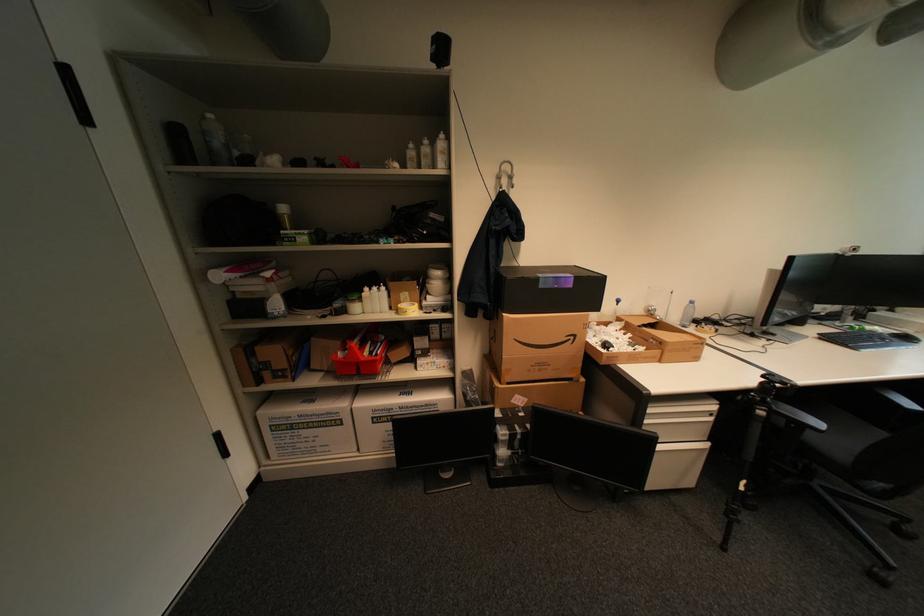
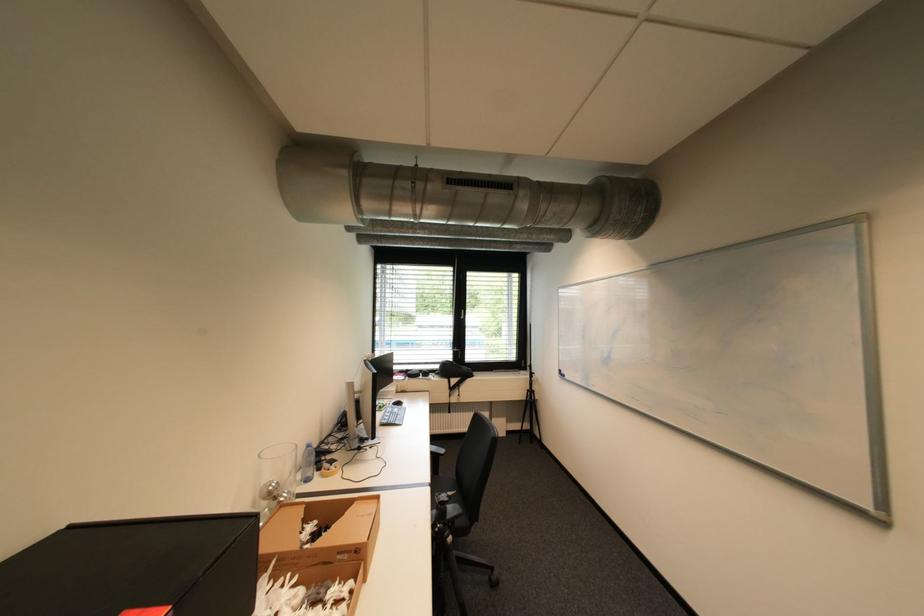
Where in the second image is the point corresponding to [801,426] from the first image?

(458, 525)